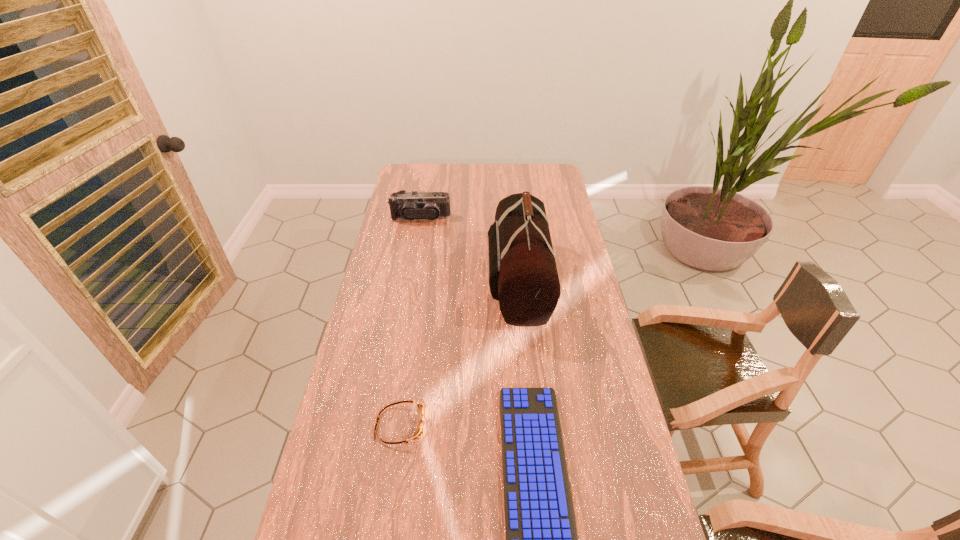
At what (x,y) coordinates should I click in order to perform the action: click on duffel bag. Please return your answer as a coordinate pair (x, y). The height and width of the screenshot is (540, 960). Looking at the image, I should click on (523, 277).

The image size is (960, 540). Identify the location of the third nearest object. (523, 277).

This screenshot has width=960, height=540. What are the coordinates of `the second tallest object` in the screenshot? It's located at (412, 205).

Find the location of a particular element. This screenshot has height=540, width=960. camcorder is located at coordinates (412, 205).

The height and width of the screenshot is (540, 960). I want to click on the third tallest object, so click(420, 431).

Image resolution: width=960 pixels, height=540 pixels. I want to click on vacant space located on the front pocket of the duffel bag, so click(428, 280).

At what (x,y) coordinates should I click in order to perform the action: click on vacant area situated on the front pocket of the duffel bag. Please return your answer as a coordinate pair (x, y). Looking at the image, I should click on (452, 280).

Where is `vacant space located 0.260m on the front pocket of the duffel bag`? vacant space located 0.260m on the front pocket of the duffel bag is located at coordinates (417, 280).

You are a GUI agent. You are given a task and a screenshot of the screen. Output one action in this format:
    pyautogui.click(x=<x>, y=<y>)
    Task: Click on the vacant area located 0.390m on the front-facing side of the third shortest object
    This screenshot has width=960, height=540.
    Given the screenshot: What is the action you would take?
    pyautogui.click(x=409, y=286)

This screenshot has height=540, width=960. What are the coordinates of `free point located 0.220m with the lenses facing forward on the second shortest object` in the screenshot? It's located at (507, 425).